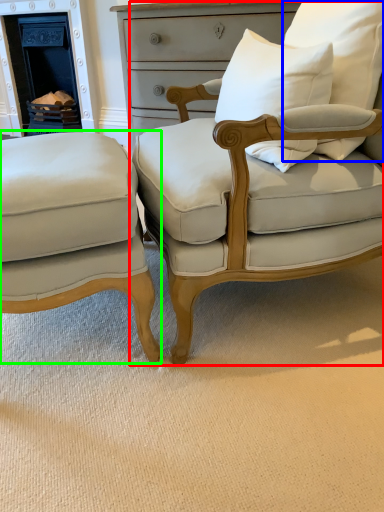
Question: Based on their relative distances, which object is nearer to chair (highlighted by a red box)? Choose from pillow (highlighted by a blue box) and chair (highlighted by a green box).

Choices:
 (A) pillow
 (B) chair

Answer: (A)